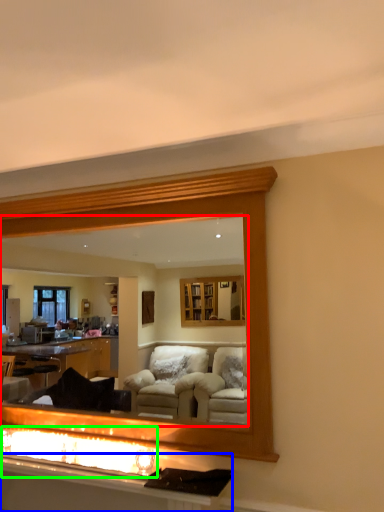
Question: Estimate the real-world distances between objects in this image. Which object is farther from mirror (highlighted by a red box), vanity (highlighted by a blue box) or reflection (highlighted by a green box)?

Choices:
 (A) vanity
 (B) reflection

Answer: (A)